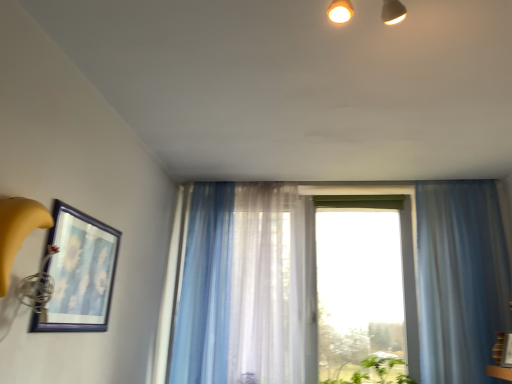
Where is `translucent blue curtain at center, the 1th curtain viewed from the left`? The image size is (512, 384). translucent blue curtain at center, the 1th curtain viewed from the left is located at coordinates (205, 288).

The height and width of the screenshot is (384, 512). Describe the element at coordinates (460, 278) in the screenshot. I see `translucent fabric window at center` at that location.

Where is `translucent blue curtain at center, placed as the 3th curtain when sorted from right to left`? translucent blue curtain at center, placed as the 3th curtain when sorted from right to left is located at coordinates (205, 288).

Is translucent blue curtain at right, the third curtain from the left, not near translucent fabric curtain at center, which is the second curtain in left-to-right order?

translucent blue curtain at right, the third curtain from the left, is actually quite close to translucent fabric curtain at center, which is the second curtain in left-to-right order.

In the scene shown: Considering the sizes of translucent blue curtain at right, the third curtain from the left, and translucent fabric curtain at center, placed as the second curtain when sorted from right to left, in the image, is translucent blue curtain at right, the third curtain from the left, bigger or smaller than translucent fabric curtain at center, placed as the second curtain when sorted from right to left,?

In the image, translucent blue curtain at right, the third curtain from the left, appears to be smaller than translucent fabric curtain at center, placed as the second curtain when sorted from right to left.

From the image's perspective, is translucent blue curtain at right, the third curtain from the left, positioned above or below translucent fabric curtain at center, placed as the second curtain when sorted from right to left?

Clearly, from the image's perspective, translucent blue curtain at right, the third curtain from the left, is above translucent fabric curtain at center, placed as the second curtain when sorted from right to left.

Considering the sizes of objects translucent blue curtain at center, placed as the 3th curtain when sorted from right to left, and translucent fabric curtain at center, which is the second curtain in left-to-right order, in the image provided, who is taller, translucent blue curtain at center, placed as the 3th curtain when sorted from right to left, or translucent fabric curtain at center, which is the second curtain in left-to-right order,?

Standing taller between the two is translucent blue curtain at center, placed as the 3th curtain when sorted from right to left.

Which object is positioned more to the left, translucent blue curtain at center, placed as the 3th curtain when sorted from right to left, or translucent fabric curtain at center, placed as the second curtain when sorted from right to left?

Positioned to the left is translucent blue curtain at center, placed as the 3th curtain when sorted from right to left.

Is translucent blue curtain at center, the 1th curtain viewed from the left, turned away from translucent fabric curtain at center, placed as the second curtain when sorted from right to left?

translucent blue curtain at center, the 1th curtain viewed from the left, is not turned away from translucent fabric curtain at center, placed as the second curtain when sorted from right to left.

From the picture: From a real-world perspective, which object stands above the other?

translucent fabric curtain at center, which is the second curtain in left-to-right order.

Are translucent fabric window at center and matte blue picture frame at left making contact?

No, translucent fabric window at center is not with matte blue picture frame at left.

Who is bigger, translucent fabric window at center or matte blue picture frame at left?

Bigger between the two is translucent fabric window at center.

How distant is translucent fabric window at center from matte blue picture frame at left?

translucent fabric window at center is 6.19 feet from matte blue picture frame at left.

Considering the positions of point (454, 309) and point (97, 252), is point (454, 309) closer or farther from the camera than point (97, 252)?

Point (454, 309) appears to be farther away from the viewer than point (97, 252).

From their relative heights in the image, would you say translucent blue curtain at center, placed as the 3th curtain when sorted from right to left, is taller or shorter than translucent blue curtain at right, the third curtain from the left?

Clearly, translucent blue curtain at center, placed as the 3th curtain when sorted from right to left, is taller compared to translucent blue curtain at right, the third curtain from the left.

Which of these two, translucent blue curtain at center, placed as the 3th curtain when sorted from right to left, or translucent blue curtain at right, which is the first curtain in right-to-left order, is thinner?

With smaller width is translucent blue curtain at right, which is the first curtain in right-to-left order.

From a real-world perspective, which object stands above the other?

translucent blue curtain at right, which is the first curtain in right-to-left order, is physically above.

From the image's perspective, is translucent blue curtain at center, the 1th curtain viewed from the left, below translucent blue curtain at right, the third curtain from the left?

Yes, from the image's perspective, translucent blue curtain at center, the 1th curtain viewed from the left, is below translucent blue curtain at right, the third curtain from the left.

From the image's perspective, is translucent fabric curtain at center, placed as the second curtain when sorted from right to left, positioned above or below matte blue picture frame at left?

translucent fabric curtain at center, placed as the second curtain when sorted from right to left, is situated lower than matte blue picture frame at left in the image.

From the image's perspective, count 2nd curtains downward from the matte blue picture frame at left and point to it. Please provide its 2D coordinates.

[(261, 283)]

Which is behind, point (272, 254) or point (90, 259)?

The point (272, 254) is farther from the camera.

Between translucent fabric curtain at center, which is the second curtain in left-to-right order, and matte blue picture frame at left, which one has larger width?

translucent fabric curtain at center, which is the second curtain in left-to-right order, is wider.

Considering the sizes of objects translucent blue curtain at center, placed as the 3th curtain when sorted from right to left, and translucent fabric window at center in the image provided, who is bigger, translucent blue curtain at center, placed as the 3th curtain when sorted from right to left, or translucent fabric window at center?

Bigger between the two is translucent fabric window at center.

Is translucent blue curtain at center, placed as the 3th curtain when sorted from right to left, inside or outside of translucent fabric window at center?

The correct answer is: inside.

Locate an element on the screen. Image resolution: width=512 pixels, height=384 pixels. window below the translucent blue curtain at center, the 1th curtain viewed from the left (from a real-world perspective) is located at coordinates (460, 278).

Looking at this image, from the image's perspective, which is below, translucent blue curtain at center, placed as the 3th curtain when sorted from right to left, or translucent fabric window at center?

translucent fabric window at center appears lower in the image.

Is translucent fabric window at center located outside translucent fabric curtain at center, which is the second curtain in left-to-right order?

Yes, translucent fabric window at center is not within translucent fabric curtain at center, which is the second curtain in left-to-right order.

Is translucent fabric window at center taller than translucent fabric curtain at center, which is the second curtain in left-to-right order?

In fact, translucent fabric window at center may be shorter than translucent fabric curtain at center, which is the second curtain in left-to-right order.

Is point (422, 238) farther from camera compared to point (269, 348)?

Yes.

Considering the sizes of translucent fabric window at center and translucent fabric curtain at center, placed as the second curtain when sorted from right to left, in the image, is translucent fabric window at center bigger or smaller than translucent fabric curtain at center, placed as the second curtain when sorted from right to left,?

In the image, translucent fabric window at center appears to be larger than translucent fabric curtain at center, placed as the second curtain when sorted from right to left.

Identify the location of curtain that is the 1st one below the translucent blue curtain at right, which is the first curtain in right-to-left order (from a real-world perspective). (261, 283).

This screenshot has height=384, width=512. In order to click on curtain lying on the left of translucent fabric curtain at center, placed as the second curtain when sorted from right to left in this screenshot , I will do `click(205, 288)`.

When comparing their distances from translucent fabric curtain at center, placed as the second curtain when sorted from right to left, does translucent blue curtain at center, placed as the 3th curtain when sorted from right to left, or matte blue picture frame at left seem further?

The object further to translucent fabric curtain at center, placed as the second curtain when sorted from right to left, is matte blue picture frame at left.

When comparing their distances from translucent fabric window at center, does translucent fabric curtain at center, which is the second curtain in left-to-right order, or translucent blue curtain at right, the third curtain from the left, seem further?

translucent fabric curtain at center, which is the second curtain in left-to-right order.

Estimate the real-world distances between objects in this image. Which object is further from translucent fabric window at center, matte blue picture frame at left or translucent blue curtain at right, the third curtain from the left?

matte blue picture frame at left.

Considering their positions, is matte blue picture frame at left positioned further to translucent fabric window at center than translucent blue curtain at center, placed as the 3th curtain when sorted from right to left?

matte blue picture frame at left.

When comparing their distances from translucent fabric curtain at center, placed as the second curtain when sorted from right to left, does translucent fabric window at center or matte blue picture frame at left seem closer?

Based on the image, translucent fabric window at center appears to be nearer to translucent fabric curtain at center, placed as the second curtain when sorted from right to left.

Considering their positions, is matte blue picture frame at left positioned closer to translucent blue curtain at center, the 1th curtain viewed from the left, than translucent fabric window at center?

Based on the image, matte blue picture frame at left appears to be nearer to translucent blue curtain at center, the 1th curtain viewed from the left.

Which object lies nearer to the anchor point matte blue picture frame at left, translucent fabric window at center or translucent blue curtain at right, which is the first curtain in right-to-left order?

translucent fabric window at center lies closer to matte blue picture frame at left than the other object.

From the image, which object appears to be farther from translucent fabric curtain at center, placed as the second curtain when sorted from right to left, translucent blue curtain at center, placed as the 3th curtain when sorted from right to left, or translucent blue curtain at right, the third curtain from the left?

translucent blue curtain at right, the third curtain from the left, is positioned further to the anchor translucent fabric curtain at center, placed as the second curtain when sorted from right to left.

Locate an element on the screen. The image size is (512, 384). window between translucent blue curtain at center, the 1th curtain viewed from the left, and translucent blue curtain at right, which is the first curtain in right-to-left order, in the horizontal direction is located at coordinates (460, 278).

Identify the location of window between matte blue picture frame at left and translucent blue curtain at right, which is the first curtain in right-to-left order, from left to right. Image resolution: width=512 pixels, height=384 pixels. (460, 278).

Where is `curtain between translucent blue curtain at center, the 1th curtain viewed from the left, and translucent fabric window at center`? The height and width of the screenshot is (384, 512). curtain between translucent blue curtain at center, the 1th curtain viewed from the left, and translucent fabric window at center is located at coordinates point(261,283).

The image size is (512, 384). What are the coordinates of `curtain between translucent blue curtain at center, the 1th curtain viewed from the left, and translucent blue curtain at right, which is the first curtain in right-to-left order, in the horizontal direction` in the screenshot? It's located at (261, 283).